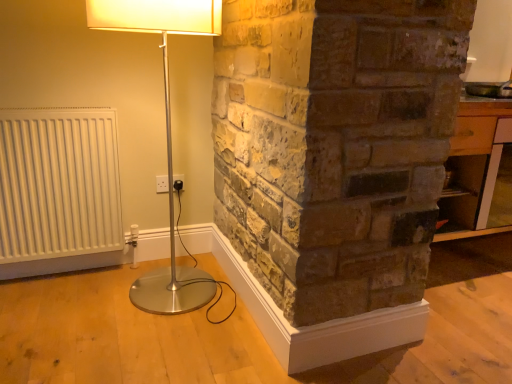
At what (x,y) coordinates should I click in order to perform the action: click on free space to the left of silver metallic floor lamp at left. Please return your answer as a coordinate pair (x, y). The image size is (512, 384). Looking at the image, I should click on (56, 317).